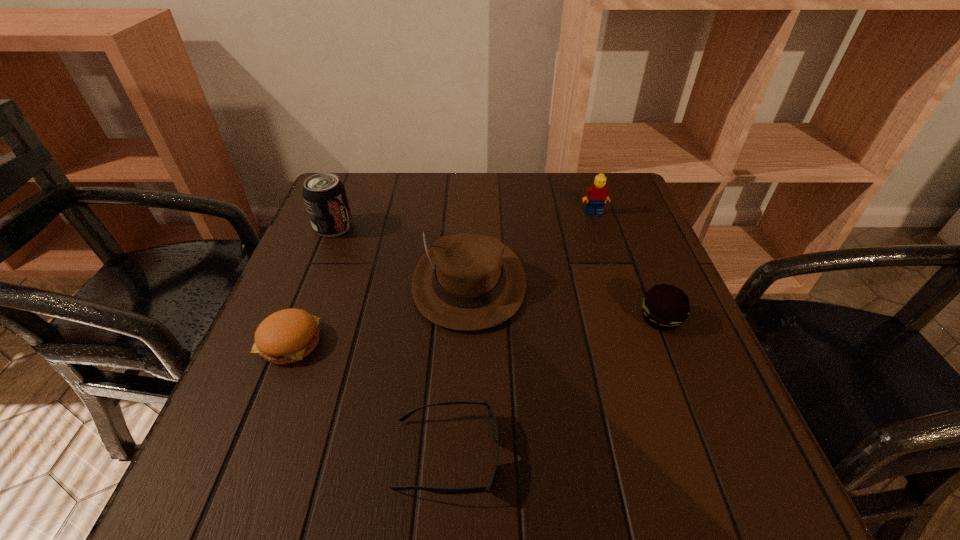
Image resolution: width=960 pixels, height=540 pixels. In order to click on patty that is at the left edge in this screenshot , I will do `click(286, 336)`.

Identify the location of Lego at the right edge. (598, 193).

Locate an element on the screen. Image resolution: width=960 pixels, height=540 pixels. patty present at the right edge is located at coordinates (665, 307).

Find the location of a particular element. This screenshot has height=540, width=960. object situated at the far left corner is located at coordinates (324, 194).

Find the location of a particular element. object that is at the far right corner is located at coordinates (598, 193).

This screenshot has height=540, width=960. I want to click on vacant area at the far edge, so click(x=509, y=198).

Where is `vacant space at the near edge of the desktop`? vacant space at the near edge of the desktop is located at coordinates click(x=388, y=477).

You are a GUI agent. You are given a task and a screenshot of the screen. Output one action in this format:
    pyautogui.click(x=<x>, y=<y>)
    Task: Click on the blank space at the left edge
    This screenshot has height=540, width=960.
    Given the screenshot: What is the action you would take?
    pyautogui.click(x=306, y=423)

In the image, there is a desktop. Where is `vacant area at the right edge`? The image size is (960, 540). vacant area at the right edge is located at coordinates (609, 282).

Find the location of `free point at the near left corner`. free point at the near left corner is located at coordinates (294, 451).